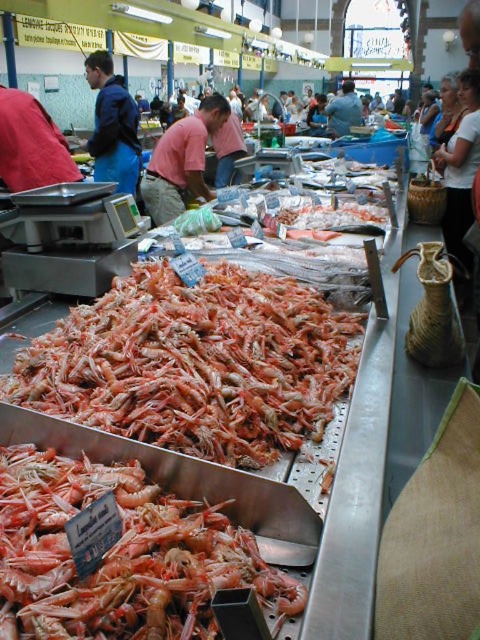
Question: Which of the following is the farthest from the observer?

Choices:
 (A) (191, 612)
 (B) (189, 161)

Answer: (B)

Question: Does pink cotton shirt at center have a larger size compared to matte blue shirt at center?

Choices:
 (A) no
 (B) yes

Answer: (B)

Question: Is shiny orange shrimp at center thinner than pink cotton shirt at center?

Choices:
 (A) no
 (B) yes

Answer: (B)

Question: Which point is closer to the camera taking this photo?

Choices:
 (A) (351, 112)
 (B) (19, 170)
 (C) (19, 515)

Answer: (C)

Question: Is pink cotton shirt at center above blue fabric jacket at upper left?

Choices:
 (A) no
 (B) yes

Answer: (A)

Question: Which object is closer to the camera taking this photo?

Choices:
 (A) matte red shirt at left
 (B) matte blue shirt at center

Answer: (A)